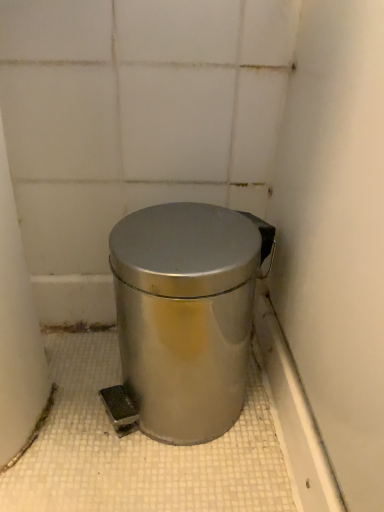
Describe the element at coordinates (184, 317) in the screenshot. The height and width of the screenshot is (512, 384). I see `polished metallic trash can at center` at that location.

This screenshot has height=512, width=384. Identify the location of polished metallic trash can at center. (184, 317).

Measure the distance between polished metallic trash can at center and camera.

A distance of 40.66 centimeters exists between polished metallic trash can at center and camera.

Locate an element on the screen. This screenshot has width=384, height=512. polished metallic trash can at center is located at coordinates 184,317.